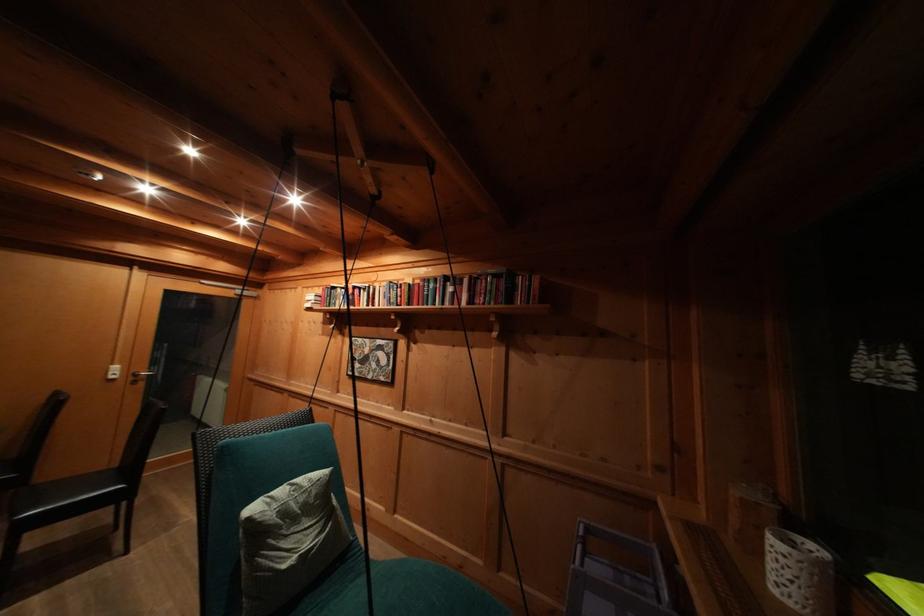
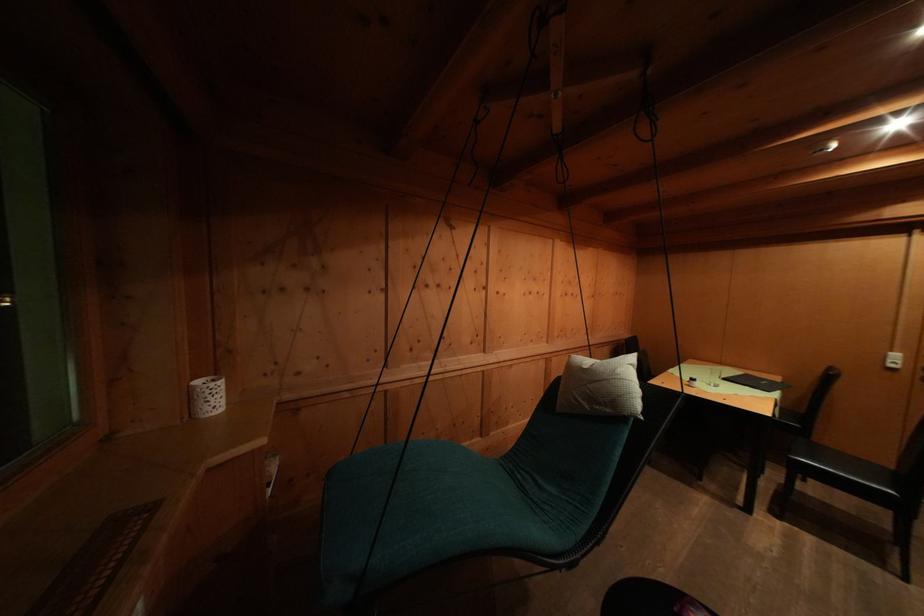
Question: The first image is from the beginning of the video and the second image is from the end. How did the camera likely rotate when shooting the video?

Choices:
 (A) Left
 (B) Right
 (C) Up
 (D) Down

Answer: (A)